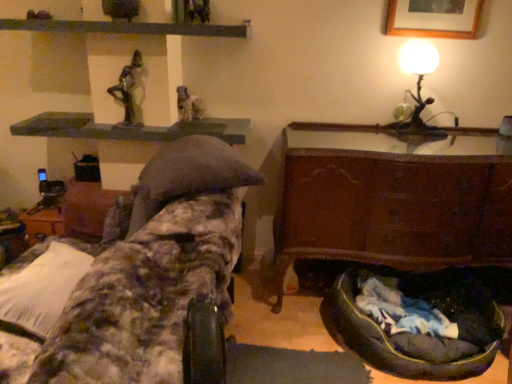
Question: From the image's perspective, is rustic wood chest at lower right, which appears as the first furniture when viewed from the right, over matte stone statue at upper center, arranged as the 2th sculpture when viewed from the left?

Choices:
 (A) no
 (B) yes

Answer: (A)

Question: Is rustic wood chest at lower right, positioned as the 2th furniture in left-to-right order, positioned in front of matte stone statue at upper center, the first sculpture positioned from the right?

Choices:
 (A) yes
 (B) no

Answer: (A)

Question: Considering the relative sizes of rustic wood chest at lower right, positioned as the 2th furniture in left-to-right order, and matte stone statue at upper center, the first sculpture positioned from the right, in the image provided, is rustic wood chest at lower right, positioned as the 2th furniture in left-to-right order, wider than matte stone statue at upper center, the first sculpture positioned from the right,?

Choices:
 (A) yes
 (B) no

Answer: (A)

Question: Can you confirm if rustic wood chest at lower right, which appears as the first furniture when viewed from the right, is taller than matte stone statue at upper center, arranged as the 2th sculpture when viewed from the left?

Choices:
 (A) no
 (B) yes

Answer: (B)

Question: Does rustic wood chest at lower right, positioned as the 2th furniture in left-to-right order, appear on the left side of matte stone statue at upper center, positioned as the 1th sculpture in back-to-front order?

Choices:
 (A) no
 (B) yes

Answer: (A)

Question: Does rustic wood chest at lower right, positioned as the 2th furniture in left-to-right order, appear on the right side of matte stone statue at upper center, marked as the 2th sculpture in a front-to-back arrangement?

Choices:
 (A) no
 (B) yes

Answer: (B)

Question: Is green metallic statue at upper center, which is the second sculpture from back to front, to the right of metallic matte table lamp at upper right from the viewer's perspective?

Choices:
 (A) no
 (B) yes

Answer: (A)

Question: From a real-world perspective, is green metallic statue at upper center, arranged as the first sculpture when viewed from the front, positioned over metallic matte table lamp at upper right based on gravity?

Choices:
 (A) no
 (B) yes

Answer: (B)

Question: Is green metallic statue at upper center, which is the second sculpture from back to front, turned away from metallic matte table lamp at upper right?

Choices:
 (A) no
 (B) yes

Answer: (A)

Question: From the image's perspective, does green metallic statue at upper center, arranged as the first sculpture when viewed from the front, appear lower than metallic matte table lamp at upper right?

Choices:
 (A) yes
 (B) no

Answer: (A)

Question: Can you confirm if green metallic statue at upper center, the 1th sculpture from the left, is taller than metallic matte table lamp at upper right?

Choices:
 (A) no
 (B) yes

Answer: (A)

Question: Considering the relative sizes of green metallic statue at upper center, the second sculpture when ordered from right to left, and metallic matte table lamp at upper right in the image provided, is green metallic statue at upper center, the second sculpture when ordered from right to left, bigger than metallic matte table lamp at upper right?

Choices:
 (A) no
 (B) yes

Answer: (A)

Question: Does metallic matte table lamp at upper right have a larger size compared to wooden picture frame at upper right?

Choices:
 (A) yes
 (B) no

Answer: (A)